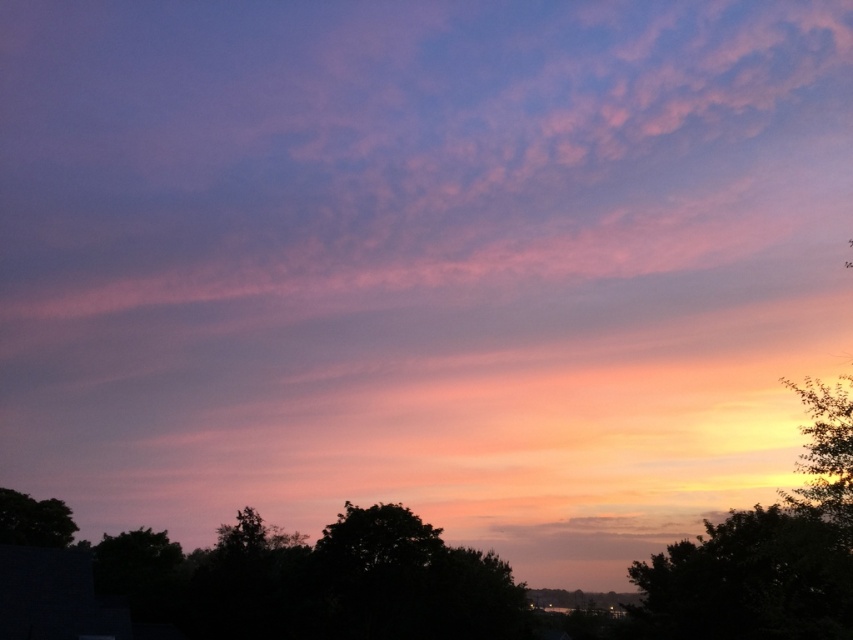
You are standing in the sunset scene and want to take a photo of the green leafy tree at lower right. Where should you position yourself to capture it in the frame?

To capture the green leafy tree at lower right, position yourself so that the tree is near the lower right corner of your camera frame, corresponding to the coordinates approximately at point 0.908 on the x and y axes.

You are standing at the center of the image and want to walk towards the horizon. There are two points marked in the scene, point (764, 592) and point (846, 404). Which point will you encounter first as you move forward?

Point (846, 404) will be encountered first because it is closer to the viewer than point (764, 592), which is positioned behind it.